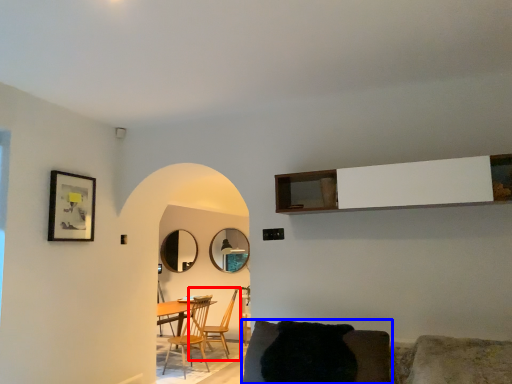
Question: Which object is further to the camera taking this photo, chair (highlighted by a red box) or chair (highlighted by a blue box)?

Choices:
 (A) chair
 (B) chair

Answer: (A)